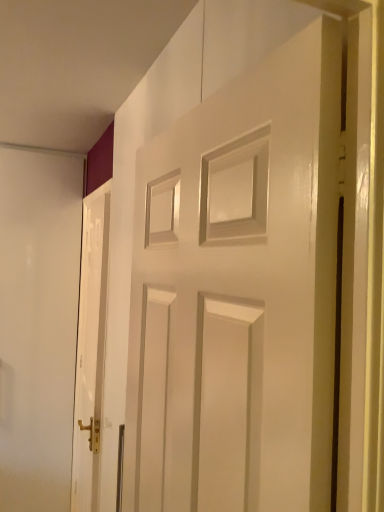
The image size is (384, 512). What do you see at coordinates (248, 271) in the screenshot? I see `glossy white door at center, which is counted as the second door, starting from the back` at bounding box center [248, 271].

Locate an element on the screen. The width and height of the screenshot is (384, 512). glossy white door at center, which is counted as the second door, starting from the back is located at coordinates (248, 271).

Image resolution: width=384 pixels, height=512 pixels. What do you see at coordinates (90, 348) in the screenshot?
I see `white glossy door at left, which is the second door in right-to-left order` at bounding box center [90, 348].

I want to click on white glossy door at left, which ranks as the 2th door in front-to-back order, so click(90, 348).

The height and width of the screenshot is (512, 384). I want to click on glossy white door at center, the first door when ordered from front to back, so click(x=248, y=271).

Is glossy white door at center, the 1th door in the right-to-left sequence, at the right side of white glossy door at left, which is the second door in right-to-left order?

Yes.

Between glossy white door at center, marked as the second door in a left-to-right arrangement, and white glossy door at left, arranged as the first door when viewed from the back, which one is positioned in front?

glossy white door at center, marked as the second door in a left-to-right arrangement, is more forward.

Which is behind, point (293, 178) or point (99, 448)?

The point (99, 448) is farther.

Based on the photo, from the image's perspective, which object appears higher, glossy white door at center, which is counted as the second door, starting from the back, or white glossy door at left, arranged as the first door when viewed from the back?

glossy white door at center, which is counted as the second door, starting from the back.

From a real-world perspective, relative to white glossy door at left, which ranks as the 2th door in front-to-back order, is glossy white door at center, which is counted as the second door, starting from the back, vertically above or below?

From a real-world perspective, glossy white door at center, which is counted as the second door, starting from the back, is physically above white glossy door at left, which ranks as the 2th door in front-to-back order.

Considering the sizes of glossy white door at center, which is counted as the second door, starting from the back, and white glossy door at left, which is the second door in right-to-left order, in the image, is glossy white door at center, which is counted as the second door, starting from the back, wider or thinner than white glossy door at left, which is the second door in right-to-left order,?

Clearly, glossy white door at center, which is counted as the second door, starting from the back, has more width compared to white glossy door at left, which is the second door in right-to-left order.

Considering the sizes of objects glossy white door at center, which is counted as the second door, starting from the back, and white glossy door at left, which is counted as the first door, starting from the left, in the image provided, who is shorter, glossy white door at center, which is counted as the second door, starting from the back, or white glossy door at left, which is counted as the first door, starting from the left,?

With less height is glossy white door at center, which is counted as the second door, starting from the back.

Is glossy white door at center, which is counted as the second door, starting from the back, bigger than white glossy door at left, which ranks as the 2th door in front-to-back order?

Yes, glossy white door at center, which is counted as the second door, starting from the back, is bigger than white glossy door at left, which ranks as the 2th door in front-to-back order.

Is glossy white door at center, marked as the second door in a left-to-right arrangement, not within white glossy door at left, which ranks as the 2th door in front-to-back order?

glossy white door at center, marked as the second door in a left-to-right arrangement, is positioned outside white glossy door at left, which ranks as the 2th door in front-to-back order.

Is glossy white door at center, the first door when ordered from front to back, far from white glossy door at left, arranged as the first door when viewed from the back?

glossy white door at center, the first door when ordered from front to back, is positioned a significant distance from white glossy door at left, arranged as the first door when viewed from the back.

Is glossy white door at center, which is counted as the second door, starting from the back, positioned with its back to white glossy door at left, which ranks as the 2th door in front-to-back order?

No.

How different are the orientations of glossy white door at center, which is counted as the second door, starting from the back, and white glossy door at left, which is counted as the first door, starting from the left, in degrees?

1.11 degrees separate the facing orientations of glossy white door at center, which is counted as the second door, starting from the back, and white glossy door at left, which is counted as the first door, starting from the left.

Measure the distance between glossy white door at center, the 1th door in the right-to-left sequence, and white glossy door at left, which is the second door in right-to-left order.

A distance of 4.52 feet exists between glossy white door at center, the 1th door in the right-to-left sequence, and white glossy door at left, which is the second door in right-to-left order.

Where is `door on the left of the glossy white door at center, the first door when ordered from front to back`? door on the left of the glossy white door at center, the first door when ordered from front to back is located at coordinates (90, 348).

Between white glossy door at left, which is counted as the first door, starting from the left, and glossy white door at center, the first door when ordered from front to back, which one appears on the left side from the viewer's perspective?

Positioned to the left is white glossy door at left, which is counted as the first door, starting from the left.

Considering the positions of objects white glossy door at left, which is the second door in right-to-left order, and glossy white door at center, marked as the second door in a left-to-right arrangement, in the image provided, who is in front, white glossy door at left, which is the second door in right-to-left order, or glossy white door at center, marked as the second door in a left-to-right arrangement,?

glossy white door at center, marked as the second door in a left-to-right arrangement, is closer to the camera.

Is point (84, 357) closer or farther from the camera than point (143, 366)?

Point (84, 357) is positioned farther from the camera compared to point (143, 366).

From the image's perspective, is white glossy door at left, arranged as the first door when viewed from the back, over glossy white door at center, marked as the second door in a left-to-right arrangement?

No, from the image's perspective, white glossy door at left, arranged as the first door when viewed from the back, is not above glossy white door at center, marked as the second door in a left-to-right arrangement.

From a real-world perspective, who is located lower, white glossy door at left, arranged as the first door when viewed from the back, or glossy white door at center, marked as the second door in a left-to-right arrangement?

From a 3D spatial view, white glossy door at left, arranged as the first door when viewed from the back, is below.

Is white glossy door at left, arranged as the first door when viewed from the back, wider than glossy white door at center, which is counted as the second door, starting from the back?

No, white glossy door at left, arranged as the first door when viewed from the back, is not wider than glossy white door at center, which is counted as the second door, starting from the back.

Does white glossy door at left, which is counted as the first door, starting from the left, have a greater height compared to glossy white door at center, which is counted as the second door, starting from the back?

Indeed, white glossy door at left, which is counted as the first door, starting from the left, has a greater height compared to glossy white door at center, which is counted as the second door, starting from the back.

Does white glossy door at left, which ranks as the 2th door in front-to-back order, have a smaller size compared to glossy white door at center, the first door when ordered from front to back?

Yes, white glossy door at left, which ranks as the 2th door in front-to-back order, is smaller than glossy white door at center, the first door when ordered from front to back.

Based on the photo, is white glossy door at left, arranged as the first door when viewed from the back, inside the boundaries of glossy white door at center, which is counted as the second door, starting from the back, or outside?

white glossy door at left, arranged as the first door when viewed from the back, is spatially situated outside glossy white door at center, which is counted as the second door, starting from the back.

Is white glossy door at left, arranged as the first door when viewed from the back, beside glossy white door at center, which is counted as the second door, starting from the back?

white glossy door at left, arranged as the first door when viewed from the back, is not next to glossy white door at center, which is counted as the second door, starting from the back, and they're not touching.

Could you tell me if white glossy door at left, which is counted as the first door, starting from the left, is facing glossy white door at center, which is counted as the second door, starting from the back?

No.

What's the angular difference between white glossy door at left, which is the second door in right-to-left order, and glossy white door at center, the first door when ordered from front to back,'s facing directions?

1.11 degrees separate the facing orientations of white glossy door at left, which is the second door in right-to-left order, and glossy white door at center, the first door when ordered from front to back.

Identify the location of door on the left of glossy white door at center, the first door when ordered from front to back. The width and height of the screenshot is (384, 512). (90, 348).

Locate an element on the screen. The image size is (384, 512). door that appears on the right of white glossy door at left, arranged as the first door when viewed from the back is located at coordinates (248, 271).

You are a GUI agent. You are given a task and a screenshot of the screen. Output one action in this format:
    pyautogui.click(x=<x>, y=<y>)
    Task: Click on the door that is under the glossy white door at center, the 1th door in the right-to-left sequence (from a real-world perspective)
    This screenshot has width=384, height=512.
    Given the screenshot: What is the action you would take?
    pyautogui.click(x=90, y=348)